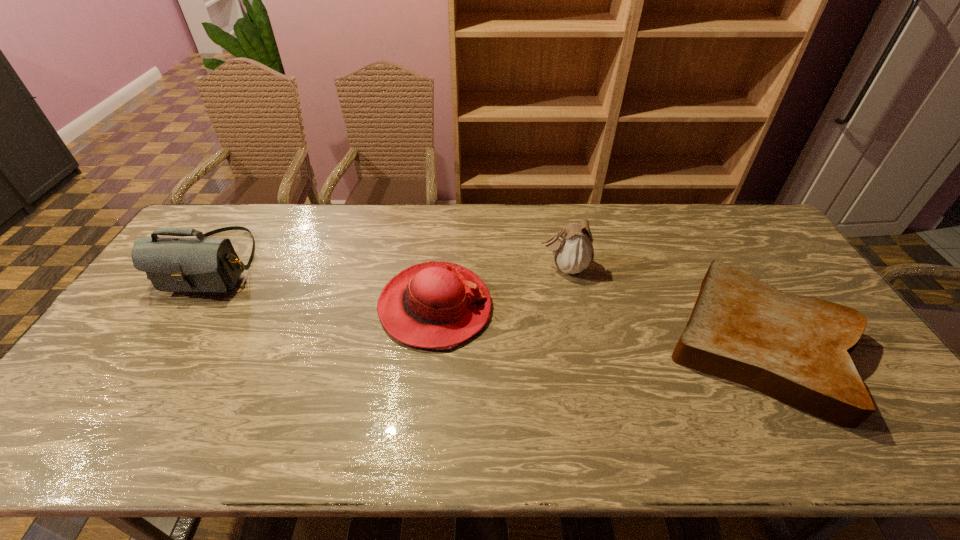
This screenshot has height=540, width=960. In order to click on the leftmost object in this screenshot , I will do `click(201, 264)`.

Locate an element on the screen. This screenshot has height=540, width=960. the second object from right to left is located at coordinates (572, 247).

In order to click on pouch in this screenshot , I will do `click(572, 247)`.

The image size is (960, 540). Find the location of `the second object from left to right`. the second object from left to right is located at coordinates (438, 305).

This screenshot has width=960, height=540. I want to click on hat, so click(x=438, y=305).

Identify the location of the rightmost object. (796, 349).

Where is `bread`? Image resolution: width=960 pixels, height=540 pixels. bread is located at coordinates (796, 349).

The height and width of the screenshot is (540, 960). In order to click on vacant region located 0.230m on the right of the shoulder bag in this screenshot , I will do `click(332, 262)`.

Where is `free location located on the front-facing side of the third object from left to right`? free location located on the front-facing side of the third object from left to right is located at coordinates [x=511, y=267].

Find the location of `vacant point located 0.110m on the front-facing side of the third object from left to right`. vacant point located 0.110m on the front-facing side of the third object from left to right is located at coordinates (505, 267).